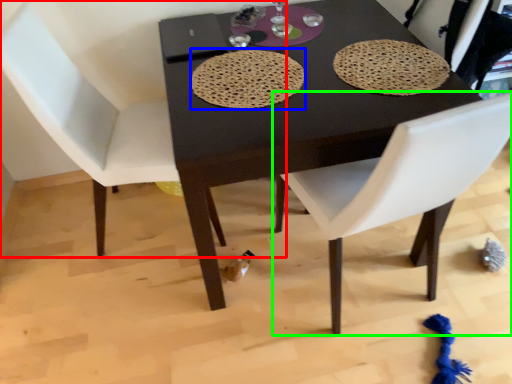
Question: Estimate the real-world distances between objects in this image. Which object is closer to chair (highlighted by a red box), mat (highlighted by a blue box) or chair (highlighted by a green box)?

Choices:
 (A) mat
 (B) chair

Answer: (A)